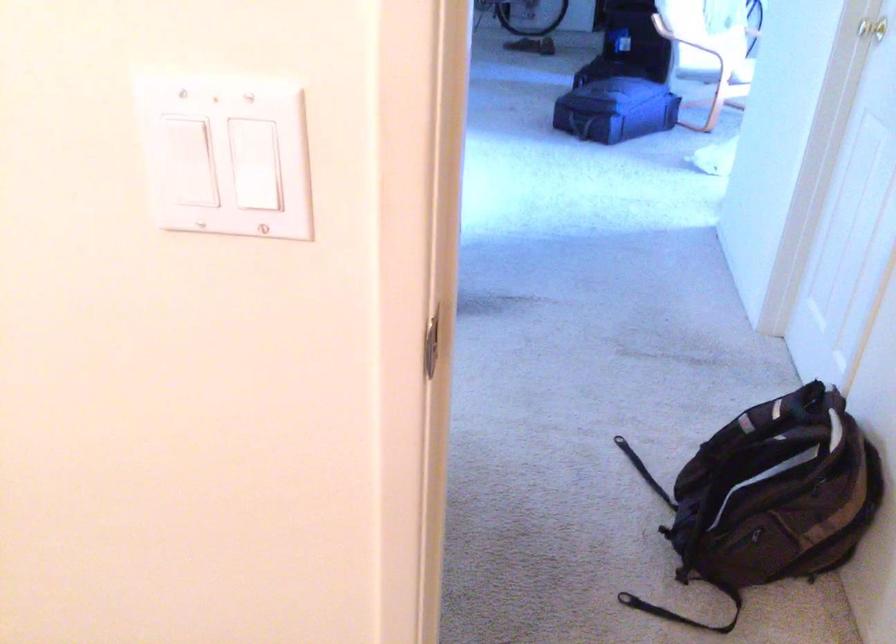
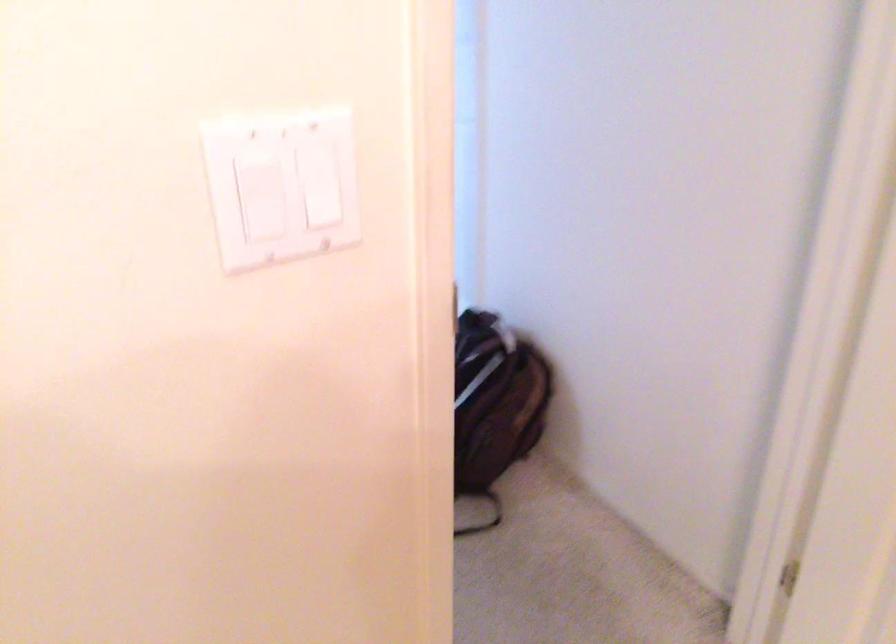
In the second image, find the point that corresponds to point 254,164 in the first image.

(326, 192)